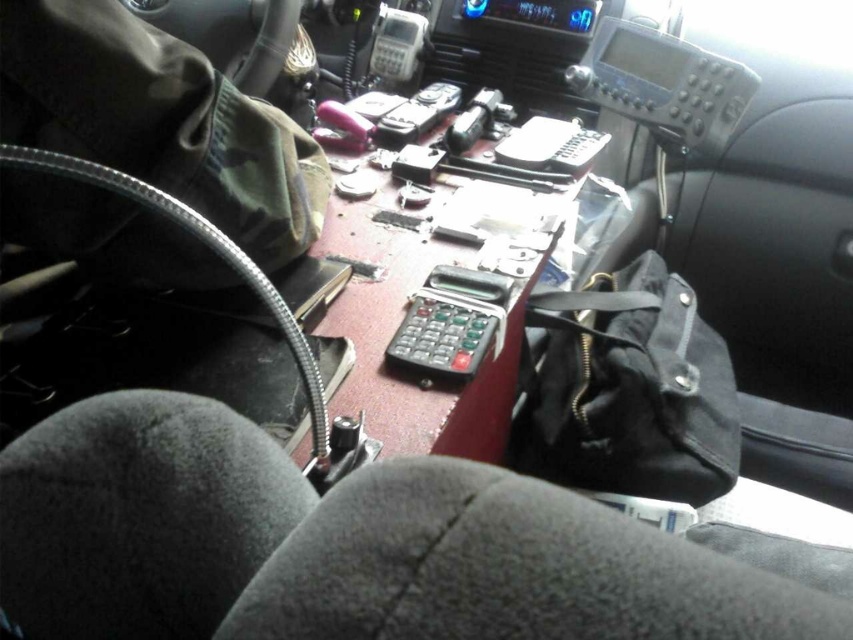
You are a police officer inside the vehicle and need to reach both the point at coordinates point (618,404) and point (399,339). Which point is closer to you?

Point (618,404) is closer to you because it is further to the viewer than point (399,339).

You are a police officer who needs to quickly access both the black plastic calculator at center and the gray plastic radio at center during an emergency. Which device is positioned lower on the dashboard?

The black plastic calculator at center is located below the gray plastic radio at center, so it is positioned lower on the dashboard.

Consider the image. You are a police officer needing to quickly access either the black plastic calculator at center or the gray plastic radio at center during an emergency. Which device can you reach faster if you are sitting in the driver seat?

The black plastic calculator at center is not as tall as the gray plastic radio at center, so it might be easier to reach quickly.